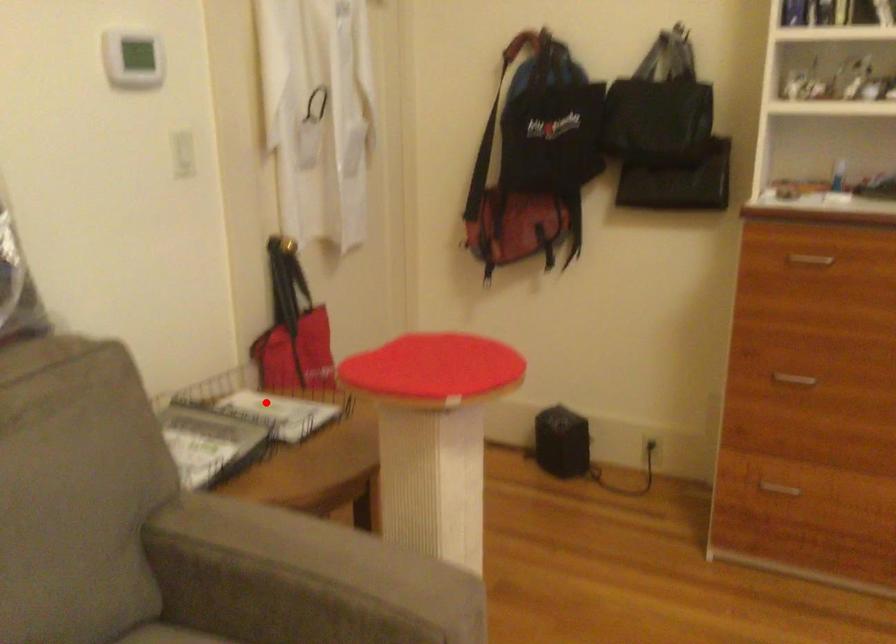
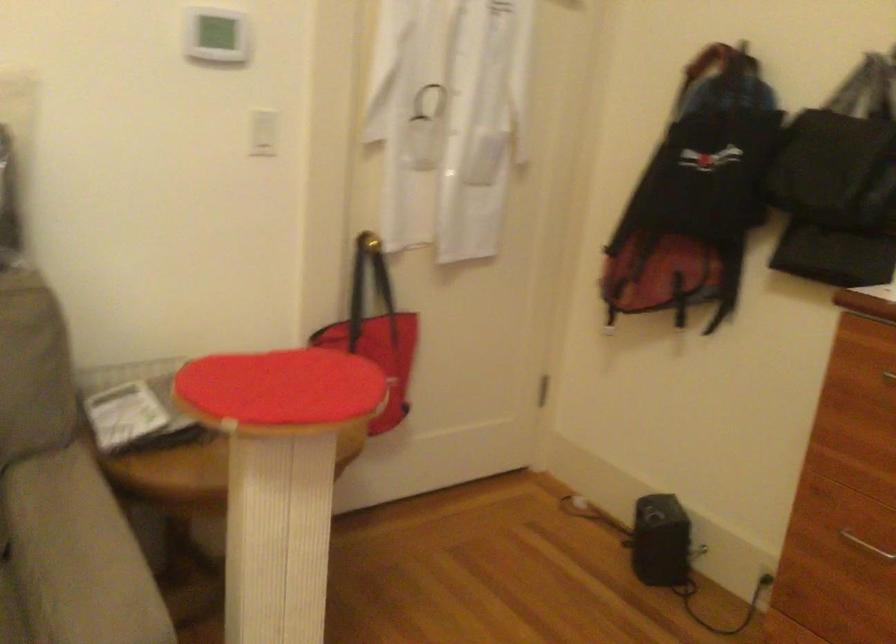
Question: I am providing you with two images of the same scene from different viewpoints. A red point is marked on the first image. Is the red point's position out of view in image 2?

Choices:
 (A) Yes
 (B) No

Answer: (A)